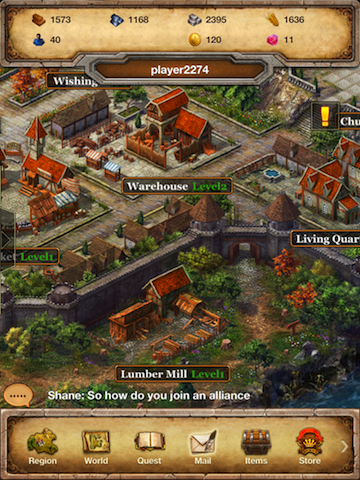
Locate an element on the screen. The height and width of the screenshot is (480, 360). the 2nd floor windows is located at coordinates (310, 181), (328, 189), (342, 148), (352, 153), (154, 289).